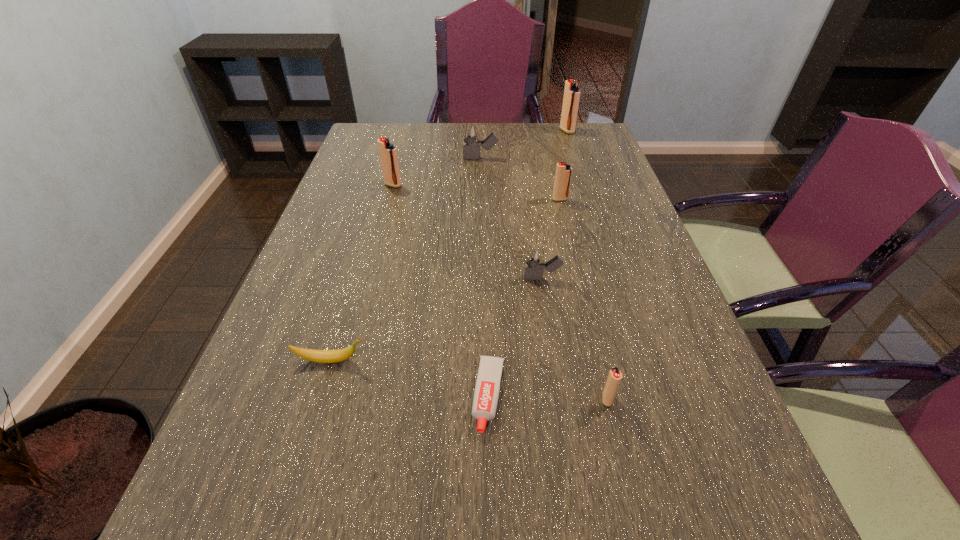
Locate an element on the screen. The height and width of the screenshot is (540, 960). the second nearest igniter is located at coordinates (535, 258).

This screenshot has width=960, height=540. Identify the location of the fifth object from left to right. (535, 258).

You are a GUI agent. You are given a task and a screenshot of the screen. Output one action in this format:
    pyautogui.click(x=<x>, y=<y>)
    Task: Click on the yellow banana
    
    Given the screenshot: What is the action you would take?
    pyautogui.click(x=319, y=356)

Where is `banana`? Image resolution: width=960 pixels, height=540 pixels. banana is located at coordinates (319, 356).

Locate an element on the screen. Image resolution: width=960 pixels, height=540 pixels. the shortest object is located at coordinates (487, 388).

The width and height of the screenshot is (960, 540). I want to click on free space located 0.090m on the left of the farthest igniter, so click(536, 131).

Locate an element on the screen. Image resolution: width=960 pixels, height=540 pixels. free space located 0.310m on the right of the fourth nearest igniter is located at coordinates point(504,185).

This screenshot has height=540, width=960. What are the coordinates of `vacant point located 0.210m on the left of the seventh nearest object` in the screenshot? It's located at tap(400, 158).

Where is `free space located on the back of the fifth nearest object`? The width and height of the screenshot is (960, 540). free space located on the back of the fifth nearest object is located at coordinates (555, 178).

Where is `free point located on the left of the nearest igniter`? This screenshot has height=540, width=960. free point located on the left of the nearest igniter is located at coordinates (486, 399).